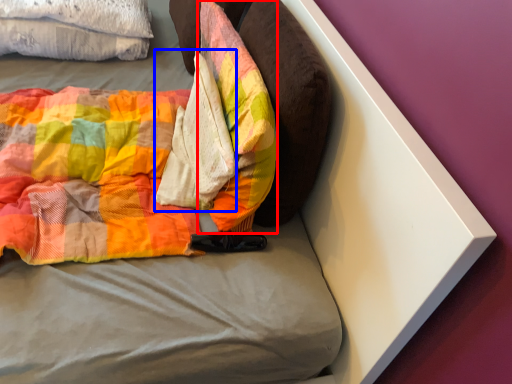
Question: Which object is closer to the camera taking this photo, pillow (highlighted by a red box) or material (highlighted by a blue box)?

Choices:
 (A) pillow
 (B) material

Answer: (A)